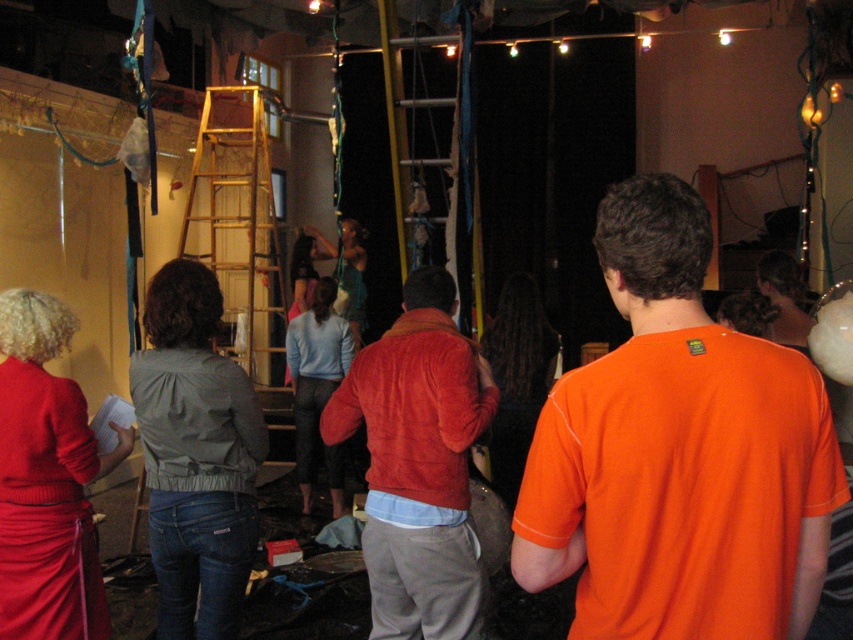
Is point (648, 416) positioned behind point (305, 365)?

No, it is in front of (305, 365).

At what (x,y) coordinates should I click in order to perform the action: click on orange t-shirt at center. Please return your answer as a coordinate pair (x, y). This screenshot has height=640, width=853. Looking at the image, I should click on (677, 452).

Identify the location of orange t-shirt at center. (677, 452).

The height and width of the screenshot is (640, 853). Find the location of `orange t-shirt at center`. orange t-shirt at center is located at coordinates (677, 452).

Between point (401, 547) and point (80, 396), which one is positioned in front?

Positioned in front is point (401, 547).

Between velvet red jacket at center and matte red sweater at lower left, which one has more height?

Standing taller between the two is velvet red jacket at center.

I want to click on velvet red jacket at center, so click(x=418, y=464).

Who is higher up, orange t-shirt at center or velvet red jacket at center?

orange t-shirt at center

Who is shorter, orange t-shirt at center or velvet red jacket at center?

Standing shorter between the two is orange t-shirt at center.

Measure the distance between point (677, 483) and camera.

They are 4.90 feet apart.

At what (x,y) coordinates should I click in order to perform the action: click on orange t-shirt at center. Please return your answer as a coordinate pair (x, y). The width and height of the screenshot is (853, 640). Looking at the image, I should click on (677, 452).